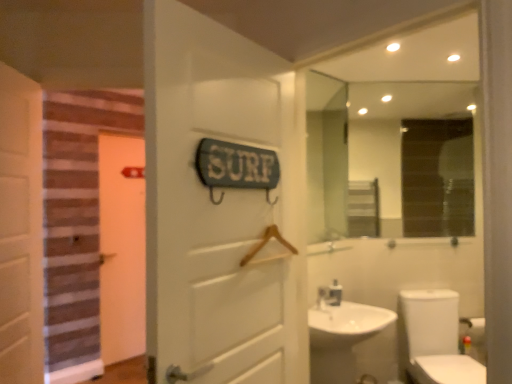
Identify the location of white glossy faucet at sink right. (334, 294).

This screenshot has width=512, height=384. What are the coordinates of `white wooden door at left, the 2th door from the back` in the screenshot? It's located at (21, 229).

What do you see at coordinates (436, 339) in the screenshot? Image resolution: width=512 pixels, height=384 pixels. I see `white glossy toilet at lower right` at bounding box center [436, 339].

Identify the location of white glossy toilet at lower right. (436, 339).

Where is `orange matte door at left, the 3th door positioned from the front`? The image size is (512, 384). orange matte door at left, the 3th door positioned from the front is located at coordinates (121, 247).

Locate an element on the screen. This screenshot has height=384, width=512. door on the left of white wooden door at left, which ranks as the second door in right-to-left order is located at coordinates (121, 247).

Which is more to the left, white wooden door at left, the 2th door viewed from the left, or orange matte door at left, the first door viewed from the left?

Positioned to the left is orange matte door at left, the first door viewed from the left.

In terms of size, does white wooden door at left, which appears as the 2th door when viewed from the front, appear bigger or smaller than orange matte door at left, the 1th door viewed from the back?

Considering their sizes, white wooden door at left, which appears as the 2th door when viewed from the front, takes up more space than orange matte door at left, the 1th door viewed from the back.

What's the angular difference between white matte door at center, arranged as the 3th door when viewed from the back, and white wooden door at left, the 2th door from the back,'s facing directions?

They differ by 28.8 degrees in their facing directions.

Can you confirm if white matte door at center, the 3th door viewed from the left, is thinner than white wooden door at left, which appears as the 2th door when viewed from the front?

Yes, white matte door at center, the 3th door viewed from the left, is thinner than white wooden door at left, which appears as the 2th door when viewed from the front.

Based on the photo, how much distance is there between white matte door at center, which is counted as the first door, starting from the front, and white wooden door at left, which ranks as the second door in right-to-left order?

A distance of 1.03 meters exists between white matte door at center, which is counted as the first door, starting from the front, and white wooden door at left, which ranks as the second door in right-to-left order.

Considering the positions of points (337, 292) and (326, 329), is point (337, 292) farther from camera compared to point (326, 329)?

Yes.

Would you say white glossy sink at lower right is part of white glossy faucet at sink right's contents?

Result: No, white glossy sink at lower right is not a part of white glossy faucet at sink right.

Between white glossy faucet at sink right and white glossy sink at lower right, which one has more height?

Standing taller between the two is white glossy sink at lower right.

Can you confirm if white glossy faucet at sink right is bigger than white glossy sink at lower right?

Incorrect, white glossy faucet at sink right is not larger than white glossy sink at lower right.

In the image, there is a white glossy sink at lower right. Where is `mirror above it (from the image's perspective)`? This screenshot has width=512, height=384. mirror above it (from the image's perspective) is located at coordinates (396, 157).

Could you tell me if white glossy sink at lower right is facing clear glass mirror at upper center?

No.

Does white glossy sink at lower right contain clear glass mirror at upper center?

No, white glossy sink at lower right does not contain clear glass mirror at upper center.

In the scene shown: Is white glossy sink at lower right wider than clear glass mirror at upper center?

Yes.

Considering the relative sizes of white glossy faucet at sink right and white wooden door at left, which appears as the 2th door when viewed from the front, in the image provided, is white glossy faucet at sink right shorter than white wooden door at left, which appears as the 2th door when viewed from the front,?

Correct, white glossy faucet at sink right is not as tall as white wooden door at left, which appears as the 2th door when viewed from the front.

Is white glossy faucet at sink right located outside white wooden door at left, the 2th door from the back?

Yes.

From a real-world perspective, between white glossy faucet at sink right and white wooden door at left, the 2th door from the back, who is vertically higher?

From a 3D spatial view, white wooden door at left, the 2th door from the back, is above.

From the image's perspective, which is above, clear glass mirror at upper center or white wooden door at left, the 2th door from the back?

clear glass mirror at upper center appears higher in the image.

Which is in front, point (355, 83) or point (36, 213)?

Positioned in front is point (36, 213).

Image resolution: width=512 pixels, height=384 pixels. In order to click on the 2nd door below the clear glass mirror at upper center (from a real-world perspective) in this screenshot , I will do `click(21, 229)`.

Can you confirm if orange matte door at left, the 3th door positioned from the right, is positioned to the left of white wooden door at left, the 2th door viewed from the left?

Indeed, orange matte door at left, the 3th door positioned from the right, is positioned on the left side of white wooden door at left, the 2th door viewed from the left.

Which object is thinner, orange matte door at left, the 3th door positioned from the right, or white wooden door at left, which ranks as the second door in right-to-left order?

orange matte door at left, the 3th door positioned from the right, is thinner.

Which is in front, orange matte door at left, the first door viewed from the left, or white wooden door at left, which appears as the 2th door when viewed from the front?

white wooden door at left, which appears as the 2th door when viewed from the front, is closer to the camera.

Can we say orange matte door at left, the 1th door viewed from the back, lies outside white wooden door at left, the 2th door viewed from the left?

That's correct, orange matte door at left, the 1th door viewed from the back, is outside of white wooden door at left, the 2th door viewed from the left.

Where is `door on the left of the white wooden door at left, which appears as the 2th door when viewed from the front`? The width and height of the screenshot is (512, 384). door on the left of the white wooden door at left, which appears as the 2th door when viewed from the front is located at coordinates (121, 247).

The width and height of the screenshot is (512, 384). I want to click on door in front of the white wooden door at left, the 2th door from the back, so click(216, 208).

In the scene shown: Looking at the image, which one is located further to orange matte door at left, the 1th door viewed from the back, clear glass mirror at upper center or white matte door at center, the 3th door viewed from the left?

white matte door at center, the 3th door viewed from the left.

Looking at the image, which one is located closer to white wooden door at left, the 2th door viewed from the left, clear glass mirror at upper center or white matte door at center, arranged as the 3th door when viewed from the back?

white matte door at center, arranged as the 3th door when viewed from the back, lies closer to white wooden door at left, the 2th door viewed from the left, than the other object.

Based on their spatial positions, is white matte door at center, the first door in the right-to-left sequence, or white glossy toilet at lower right further from white glossy sink at lower right?

white matte door at center, the first door in the right-to-left sequence.

Which object lies further to the anchor point white glossy sink at lower right, orange matte door at left, the 1th door viewed from the back, or white wooden door at left, the 2th door from the back?

orange matte door at left, the 1th door viewed from the back, lies further to white glossy sink at lower right than the other object.

Looking at this image, based on their spatial positions, is orange matte door at left, the first door viewed from the left, or white matte door at center, the 3th door viewed from the left, further from white glossy sink at lower right?

orange matte door at left, the first door viewed from the left, is further to white glossy sink at lower right.

From the image, which object appears to be farther from white glossy faucet at sink right, orange matte door at left, the 1th door viewed from the back, or white wooden door at left, the 2th door from the back?

orange matte door at left, the 1th door viewed from the back.

From the image, which object appears to be nearer to white glossy faucet at sink right, white matte door at center, which is counted as the first door, starting from the front, or white glossy toilet at lower right?

white glossy toilet at lower right lies closer to white glossy faucet at sink right than the other object.

From the image, which object appears to be nearer to orange matte door at left, the 1th door viewed from the back, clear glass mirror at upper center or white glossy sink at lower right?

Based on the image, white glossy sink at lower right appears to be nearer to orange matte door at left, the 1th door viewed from the back.

The height and width of the screenshot is (384, 512). In order to click on faucet between white matte door at center, which is counted as the first door, starting from the front, and orange matte door at left, the 1th door viewed from the back, from front to back in this screenshot , I will do `click(334, 294)`.

At what (x,y) coordinates should I click in order to perform the action: click on toilet bowl positioned between white matte door at center, which is counted as the first door, starting from the front, and orange matte door at left, the 3th door positioned from the right, from near to far. Please return your answer as a coordinate pair (x, y). This screenshot has height=384, width=512. Looking at the image, I should click on (436, 339).

Identify the location of sink between orange matte door at left, the 1th door viewed from the back, and clear glass mirror at upper center. (342, 338).

What are the coordinates of `door positioned between white matte door at center, which is counted as the first door, starting from the front, and orange matte door at left, the 3th door positioned from the right, from near to far` in the screenshot? It's located at (21, 229).